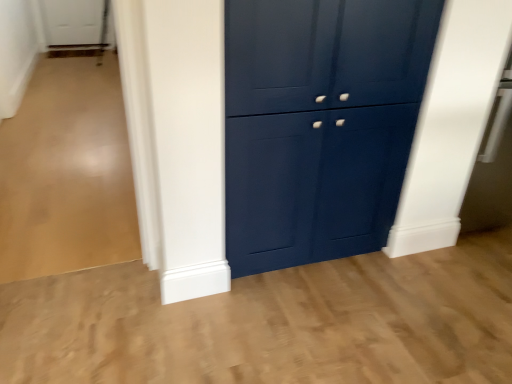
You are a GUI agent. You are given a task and a screenshot of the screen. Output one action in this format:
    pyautogui.click(x=<x>, y=<y>)
    Task: Click on the free spot below glossy blue cupboard at center (from a real-world perspective)
    The image size is (512, 384).
    Given the screenshot: What is the action you would take?
    pyautogui.click(x=306, y=263)